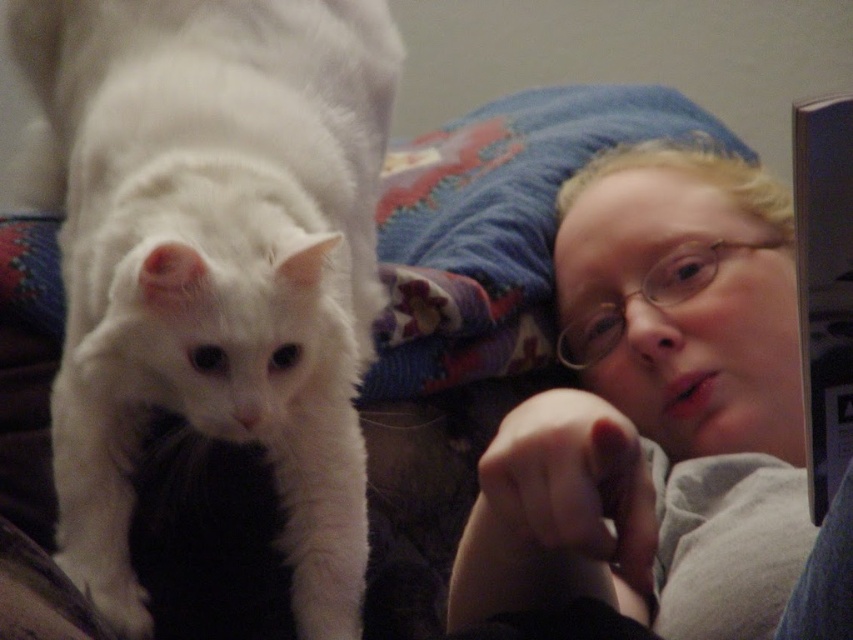
You are a photographer trying to capture a clear shot of the smooth gray shirt at upper right and the white fluffy paw at lower left. Since you want to focus on both objects, which one should you adjust your camera lens to prioritize focusing on first, considering their positions?

The smooth gray shirt at upper right is much taller than the white fluffy paw at lower left, so you should prioritize focusing on the smooth gray shirt at upper right first because it is farther away and requires proper depth of field.

You are a photographer trying to capture the white fluffy cat at left and the white fluffy paw at lower left in a single frame. Based on their positions, can you determine which object is closer to the camera?

The white fluffy cat at left is closer to the camera than the white fluffy paw at lower left because it is positioned to the left of the paw.

You are a photographer trying to capture a clear shot of the smooth gray shirt at upper right and the white fluffy paw at lower left. However, you notice that one object is blocking the view of the other. Which object is in front and which is behind?

The white fluffy paw at lower left is behind the smooth gray shirt at upper right, so the smooth gray shirt at upper right is in front and blocking the view of the white fluffy paw at lower left.